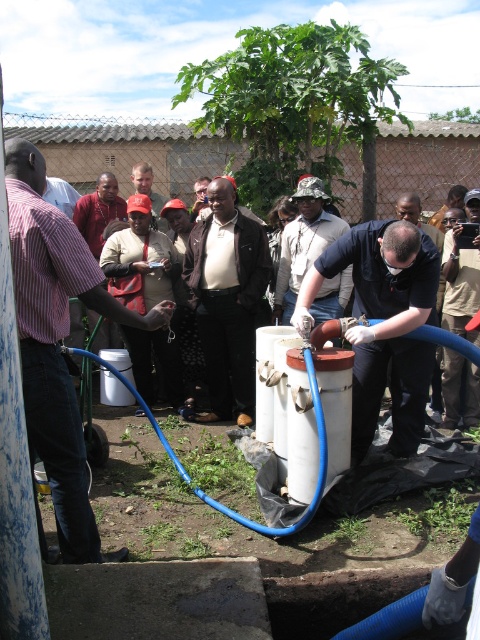
Question: Which of the following is the closest to the observer?

Choices:
 (A) (66, 474)
 (B) (200, 323)
 (C) (352, 232)
 (D) (135, 170)

Answer: (A)

Question: Is matte pink shirt at left to the left of white matte tank at center from the viewer's perspective?

Choices:
 (A) no
 (B) yes

Answer: (B)

Question: Can you confirm if matte pink shirt at left is positioned to the right of striped cotton shirt at center?

Choices:
 (A) yes
 (B) no

Answer: (A)

Question: Which object is the farthest from the camouflage fabric shirt at center?

Choices:
 (A) striped cotton shirt at center
 (B) black matte shirt at center
 (C) light brown leather jacket at center

Answer: (A)

Question: Does matte pink shirt at left come behind light brown leather jacket at center?

Choices:
 (A) no
 (B) yes

Answer: (A)

Question: Which object is positioned farthest from the striped cotton shirt at center?

Choices:
 (A) black leather jacket at center
 (B) white matte tank at center
 (C) black matte shirt at center

Answer: (B)